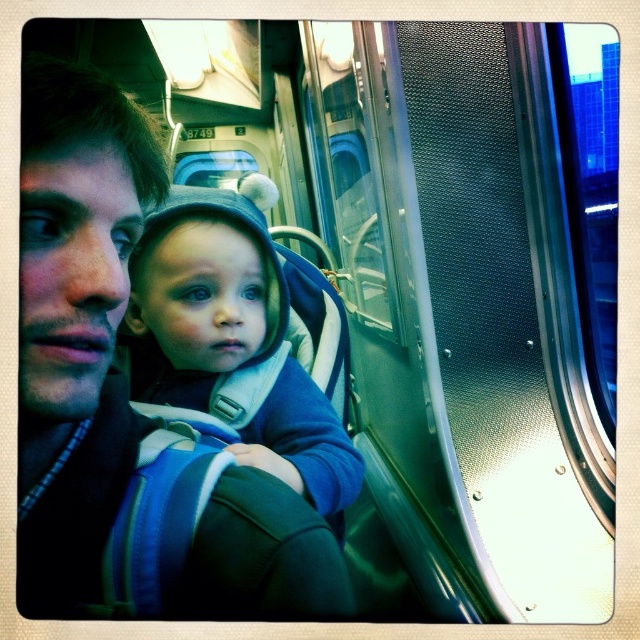
Who is taller, matte black jacket at left or blue fleece jacket at center?

Standing taller between the two is blue fleece jacket at center.

Which is below, matte black jacket at left or blue fleece jacket at center?

blue fleece jacket at center is below.

You are a GUI agent. You are given a task and a screenshot of the screen. Output one action in this format:
    pyautogui.click(x=<x>, y=<y>)
    Task: Click on the matte black jacket at left
    Image resolution: width=640 pixels, height=640 pixels.
    Given the screenshot: What is the action you would take?
    pyautogui.click(x=125, y=401)

The height and width of the screenshot is (640, 640). I want to click on matte black jacket at left, so click(125, 401).